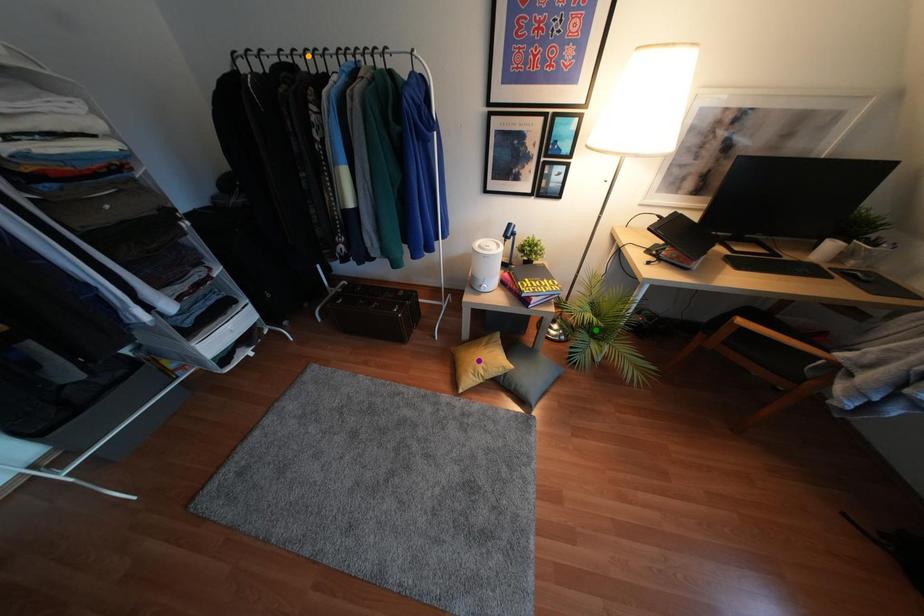
Order these from farthest to nearest:
green point, purple point, orange point

green point
purple point
orange point